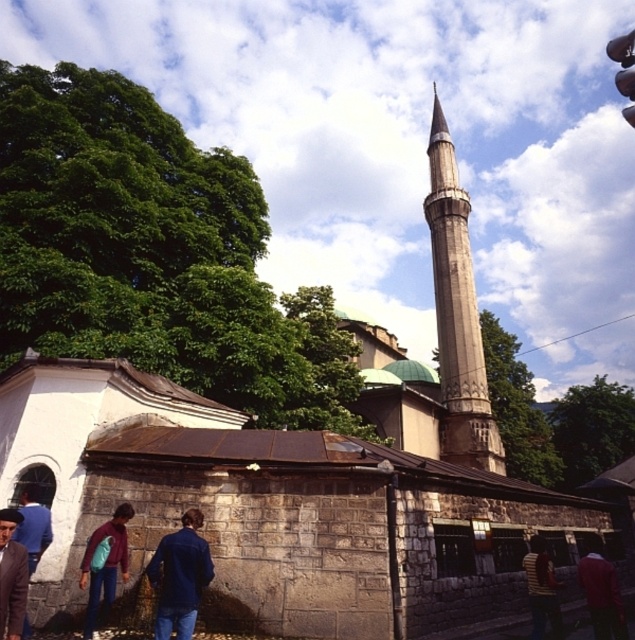
Question: Does blue denim jacket at lower center come behind blue denim jacket at lower left?

Choices:
 (A) yes
 (B) no

Answer: (B)

Question: Which object is closer to the camera taking this photo?

Choices:
 (A) blue denim jacket at lower center
 (B) smooth stone minaret at center

Answer: (A)

Question: From the image, what is the correct spatial relationship of smooth stone minaret at center in relation to denim jacket at lower left?

Choices:
 (A) left
 (B) right

Answer: (B)

Question: Estimate the real-world distances between objects in this image. Which object is closer to the smooth stone minaret at center?

Choices:
 (A) blue denim jacket at lower center
 (B) denim jacket at lower left
 (C) brown leather jacket at lower left
 (D) dark blue jacket at lower right

Answer: (D)

Question: Does denim jacket at lower left appear over striped shirt at lower right?

Choices:
 (A) yes
 (B) no

Answer: (A)

Question: Which of these objects is positioned farthest from the smooth stone minaret at center?

Choices:
 (A) blue denim jacket at lower center
 (B) denim jacket at lower left
 (C) brown leather jacket at lower left

Answer: (C)